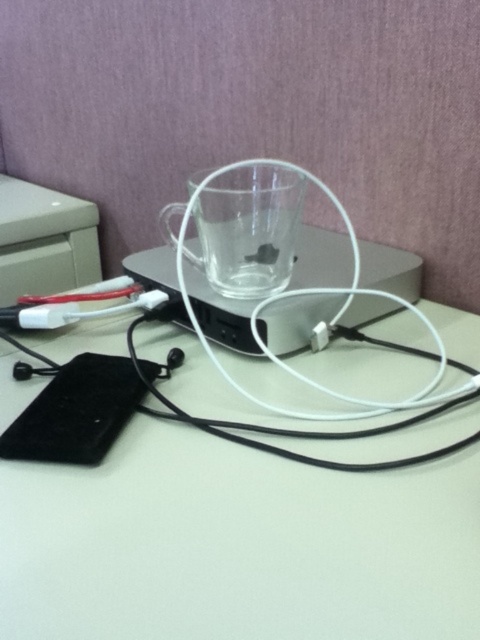
Question: Which point appears closest to the camera in this image?

Choices:
 (A) (170, 358)
 (B) (396, 502)

Answer: (B)

Question: Which of the following is the farthest from the observer?

Choices:
 (A) (182, 362)
 (B) (304, 490)

Answer: (A)

Question: Is white matte table at lower center positioned before black rubber earphone at lower center?

Choices:
 (A) no
 (B) yes

Answer: (B)

Question: Can you confirm if white matte table at lower center is thinner than black rubber earphone at lower center?

Choices:
 (A) yes
 (B) no

Answer: (B)

Question: Is white matte table at lower center to the right of black rubber earphone at lower center from the viewer's perspective?

Choices:
 (A) no
 (B) yes

Answer: (B)

Question: Which point is farther to the camera?

Choices:
 (A) (328, 544)
 (B) (178, 364)

Answer: (B)